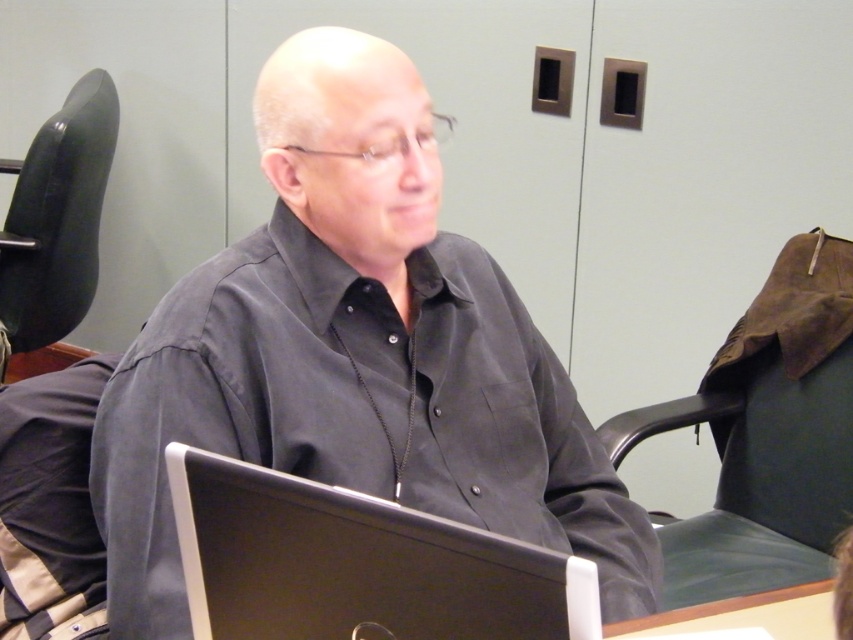
You are standing behind the man in the image and want to walk to the point labeled point (489, 621). Which direction should you move relative to point (22, 170)?

Since point (489, 621) is in front of point (22, 170), you should move forward towards point (489, 621) while facing the same direction as the man.

You are a delivery person entering an office and see a man in a matte black shirt at center and a black plastic laptop at center. Which object is closer to you?

The matte black shirt at center is closer to you because the black plastic laptop at center is behind it.

You are trying to determine if a new desk accessory that requires 20 cm of space can fit on the black leather chair at left or the wooden table at lower right. Based on their widths, which object can accommodate the accessory?

The wooden table at lower right is wider than the black leather chair at left, so the accessory can fit on the wooden table at lower right.